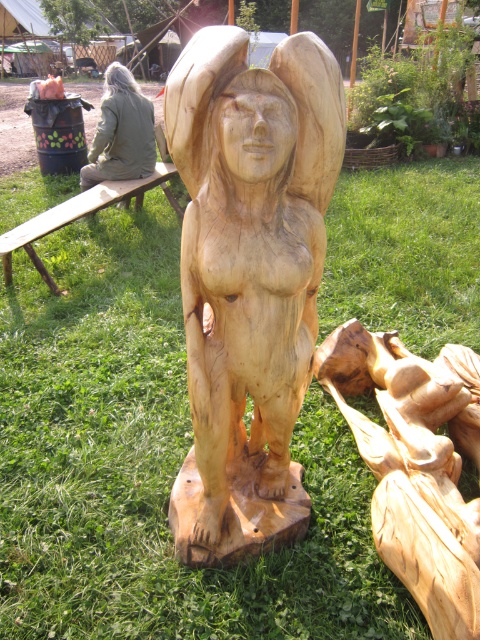
Is natural wood statue at center smaller than green fabric jacket at left?

Incorrect, natural wood statue at center is not smaller in size than green fabric jacket at left.

Is natural wood statue at center above green fabric jacket at left?

Incorrect, natural wood statue at center is not positioned above green fabric jacket at left.

Identify the location of natural wood statue at center. (249, 275).

Can you confirm if natural wood statue at center is positioned below natural wood carving at center?

No.

Identify the location of natural wood statue at center. The width and height of the screenshot is (480, 640). (249, 275).

Does natural wood carving at center have a smaller size compared to green fabric jacket at left?

A: Incorrect, natural wood carving at center is not smaller in size than green fabric jacket at left.

Does natural wood carving at center lie in front of green fabric jacket at left?

Yes, it is.

Locate an element on the screen. natural wood carving at center is located at coordinates (411, 470).